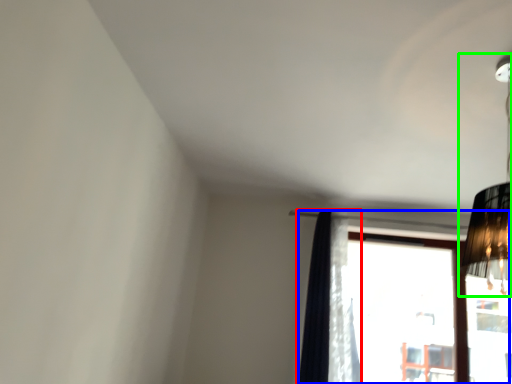
Question: Which object is positioned closest to curtain (highlighted by a red box)? Select from window (highlighted by a blue box) and lamp (highlighted by a green box).

Choices:
 (A) window
 (B) lamp

Answer: (B)